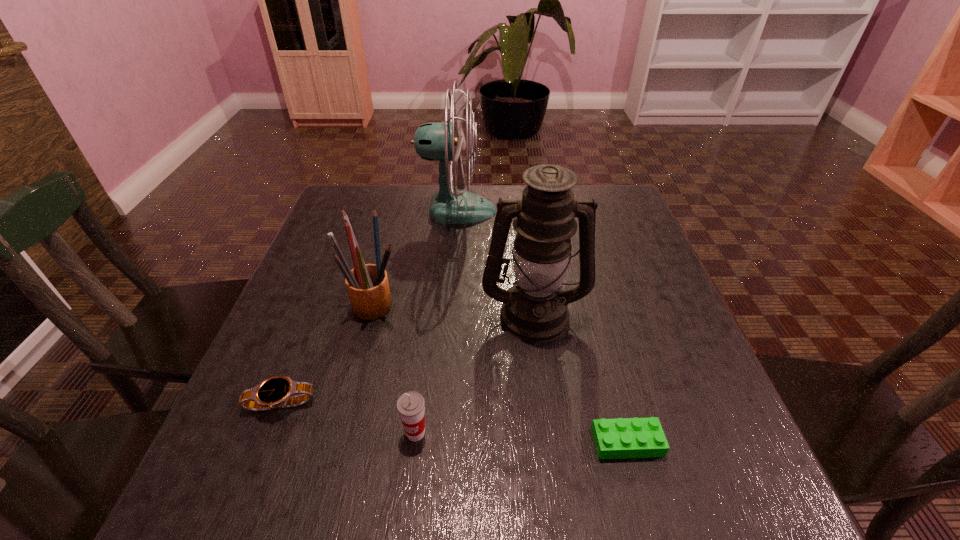
Find the location of a particular element. The width and height of the screenshot is (960, 540). object that can be found as the third closest to the watch is located at coordinates (534, 309).

The image size is (960, 540). What are the coordinates of `object that is the second nearest to the watch` in the screenshot? It's located at (411, 406).

At what (x,y) coordinates should I click in order to perform the action: click on vacant area in the image that satisfies the following two spatial constraints: 1. in front of the farthest object, directing airflow; 2. on the side of the third shortest object with the logo. Please return your answer as a coordinate pair (x, y). Looking at the image, I should click on (441, 433).

You are a GUI agent. You are given a task and a screenshot of the screen. Output one action in this format:
    pyautogui.click(x=<x>, y=<y>)
    Task: Click on the free space in the image that satisfies the following two spatial constraints: 1. on the front side of the Lego; 2. on the right side of the fourth shortest object
    This screenshot has width=960, height=540.
    Given the screenshot: What is the action you would take?
    pyautogui.click(x=341, y=442)

I want to click on vacant region that satisfies the following two spatial constraints: 1. in front of the oil lamp, directing airflow; 2. on the left side of the farthest object, so click(x=449, y=314).

Where is `free spot that satisfies the following two spatial constraints: 1. on the front side of the pencil box; 2. on the right side of the oil lamp`? This screenshot has width=960, height=540. free spot that satisfies the following two spatial constraints: 1. on the front side of the pencil box; 2. on the right side of the oil lamp is located at coordinates (373, 314).